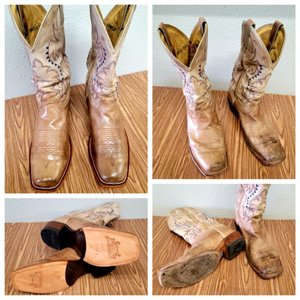
This screenshot has height=300, width=300. In order to click on handles in this screenshot , I will do `click(276, 28)`.